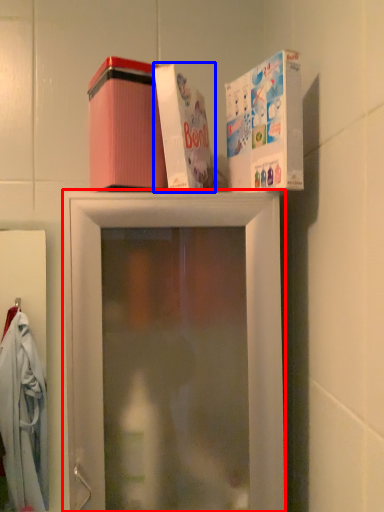
Question: Which object appears closest to the camera in this image, shelf (highlighted by a red box) or box (highlighted by a blue box)?

Choices:
 (A) shelf
 (B) box

Answer: (A)